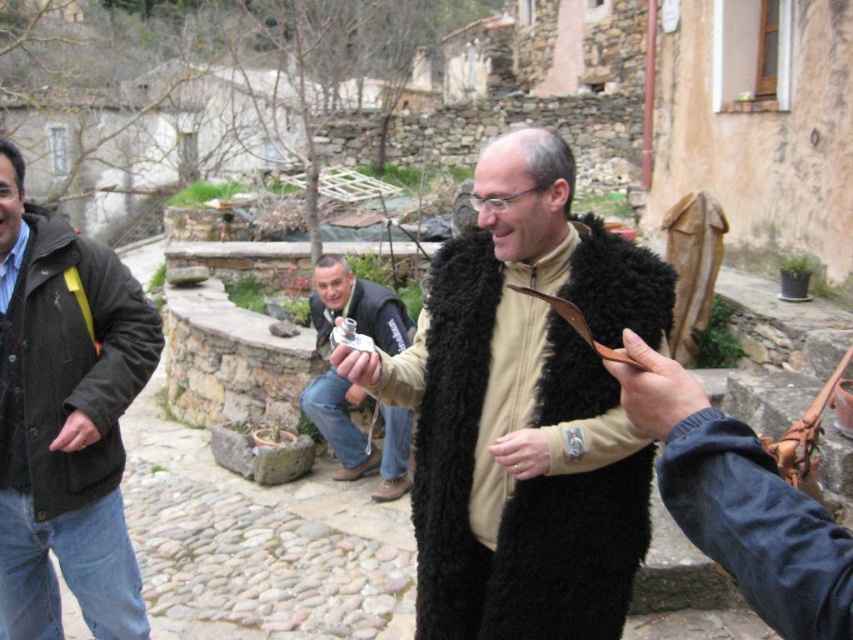
Who is taller, dark green woolen jacket at left or brown leather hand at center?

With more height is dark green woolen jacket at left.

Is point (57, 616) less distant than point (693, 403)?

No, (57, 616) is further to viewer.

Image resolution: width=853 pixels, height=640 pixels. What are the coordinates of `dark green woolen jacket at left` in the screenshot? It's located at (64, 419).

You are a GUI agent. You are given a task and a screenshot of the screen. Output one action in this format:
    pyautogui.click(x=<x>, y=<y>)
    Task: Click on the dark green woolen jacket at left
    The height and width of the screenshot is (640, 853).
    Given the screenshot: What is the action you would take?
    pyautogui.click(x=64, y=419)

Between dark green woolen jacket at left and matte silver watch at center, which one has less height?

matte silver watch at center

Identify the location of dark green woolen jacket at left. This screenshot has height=640, width=853. (64, 419).

Does brown leather hand at center appear on the right side of matte black fur coat at center?

Yes, brown leather hand at center is to the right of matte black fur coat at center.

Is brown leather hand at center shorter than matte black fur coat at center?

Incorrect, brown leather hand at center's height does not fall short of matte black fur coat at center's.

The width and height of the screenshot is (853, 640). What are the coordinates of `brown leather hand at center` in the screenshot? It's located at (654, 388).